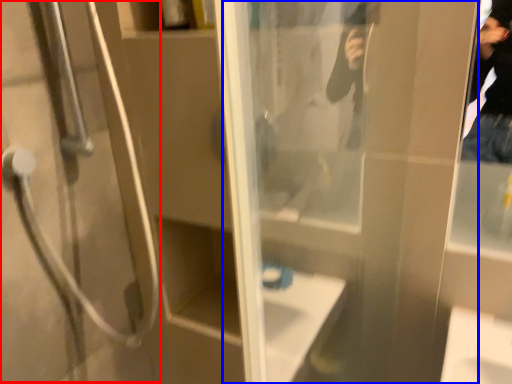
Question: Among these objects, which one is farthest to the camera, shower door (highlighted by a red box) or screen door (highlighted by a blue box)?

Choices:
 (A) shower door
 (B) screen door

Answer: (A)